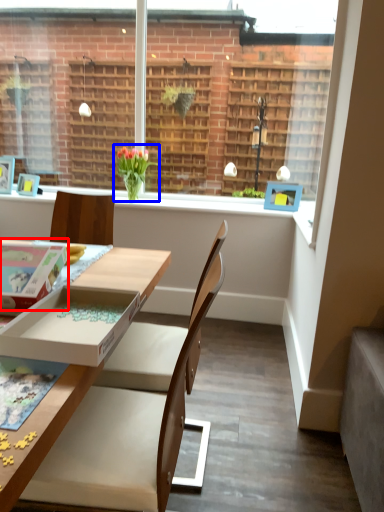
Question: Which object is closer to the camera taking this photo, box (highlighted by a red box) or houseplant (highlighted by a blue box)?

Choices:
 (A) box
 (B) houseplant

Answer: (A)